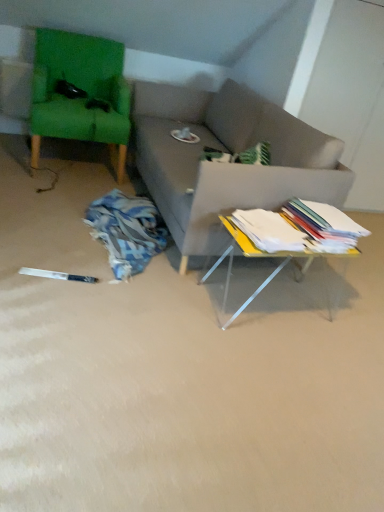
The image size is (384, 512). What do you see at coordinates (84, 94) in the screenshot?
I see `green fabric swivel chair at upper left` at bounding box center [84, 94].

Describe the element at coordinates (257, 256) in the screenshot. This screenshot has height=512, width=384. I see `yellow acrylic table at lower right` at that location.

Where is `green fabric swivel chair at upper left`? The height and width of the screenshot is (512, 384). green fabric swivel chair at upper left is located at coordinates (84, 94).

From a real-world perspective, between yellow acrylic table at lower right and green fabric swivel chair at upper left, who is vertically higher?

From a 3D spatial view, green fabric swivel chair at upper left is above.

Which object is closer to the camera taking this photo, yellow acrylic table at lower right or green fabric swivel chair at upper left?

Positioned in front is yellow acrylic table at lower right.

Which is farther from the camera, (241, 245) or (115, 91)?

The point (115, 91) is farther.

There is a yellow acrylic table at lower right. In order to click on swivel chair above it (from a real-world perspective) in this screenshot , I will do `click(84, 94)`.

Considering the relative sizes of white paper stack at center, which is counted as the second book, starting from the right, and yellow acrylic table at lower right in the image provided, is white paper stack at center, which is counted as the second book, starting from the right, smaller than yellow acrylic table at lower right?

Indeed, white paper stack at center, which is counted as the second book, starting from the right, has a smaller size compared to yellow acrylic table at lower right.

Could you tell me if white paper stack at center, which is counted as the second book, starting from the right, is turned towards yellow acrylic table at lower right?

No, white paper stack at center, which is counted as the second book, starting from the right, is not oriented towards yellow acrylic table at lower right.

From a real-world perspective, does white paper stack at center, arranged as the first book when viewed from the left, sit lower than yellow acrylic table at lower right?

No.

Does green fabric swivel chair at upper left appear on the right side of white paper stack at right, positioned as the 1th book in right-to-left order?

In fact, green fabric swivel chair at upper left is to the left of white paper stack at right, positioned as the 1th book in right-to-left order.

From a real-world perspective, is green fabric swivel chair at upper left on top of white paper stack at right, positioned as the 1th book in right-to-left order?

No, from a real-world perspective, green fabric swivel chair at upper left is not over white paper stack at right, positioned as the 1th book in right-to-left order

Which of these two, green fabric swivel chair at upper left or white paper stack at right, the 2th book when ordered from left to right, is thinner?

Thinner between the two is white paper stack at right, the 2th book when ordered from left to right.

Consider the image. Considering the sizes of green fabric swivel chair at upper left and white paper stack at right, the 2th book when ordered from left to right, in the image, is green fabric swivel chair at upper left taller or shorter than white paper stack at right, the 2th book when ordered from left to right,?

In the image, green fabric swivel chair at upper left appears to be taller than white paper stack at right, the 2th book when ordered from left to right.

Considering the positions of points (94, 63) and (249, 237), is point (94, 63) farther from camera compared to point (249, 237)?

Yes.

How far apart are green fabric swivel chair at upper left and white paper stack at center, arranged as the first book when viewed from the left?

The distance of green fabric swivel chair at upper left from white paper stack at center, arranged as the first book when viewed from the left, is 1.60 meters.

Would you say green fabric swivel chair at upper left is outside white paper stack at center, which is counted as the second book, starting from the right?

Yes, green fabric swivel chair at upper left is outside of white paper stack at center, which is counted as the second book, starting from the right.

From the picture: Could you tell me if green fabric swivel chair at upper left is facing white paper stack at center, which is counted as the second book, starting from the right?

Yes, green fabric swivel chair at upper left is turned towards white paper stack at center, which is counted as the second book, starting from the right.

Which is more to the left, white paper stack at center, arranged as the first book when viewed from the left, or green fabric swivel chair at upper left?

Positioned to the left is green fabric swivel chair at upper left.

Which of these two, white paper stack at center, which is counted as the second book, starting from the right, or green fabric swivel chair at upper left, is thinner?

With smaller width is white paper stack at center, which is counted as the second book, starting from the right.

Considering their positions, is white paper stack at center, which is counted as the second book, starting from the right, located in front of or behind green fabric swivel chair at upper left?

In the image, white paper stack at center, which is counted as the second book, starting from the right, appears in front of green fabric swivel chair at upper left.

Would you say white paper stack at center, arranged as the first book when viewed from the left, contains green fabric swivel chair at upper left?

No, green fabric swivel chair at upper left is not inside white paper stack at center, arranged as the first book when viewed from the left.

Which object is wider, yellow acrylic table at lower right or white paper stack at right, the 2th book when ordered from left to right?

yellow acrylic table at lower right.

Looking at this image, considering the sizes of objects yellow acrylic table at lower right and white paper stack at right, positioned as the 1th book in right-to-left order, in the image provided, who is shorter, yellow acrylic table at lower right or white paper stack at right, positioned as the 1th book in right-to-left order,?

white paper stack at right, positioned as the 1th book in right-to-left order, is shorter.

Is yellow acrylic table at lower right smaller than white paper stack at right, positioned as the 1th book in right-to-left order?

No, yellow acrylic table at lower right is not smaller than white paper stack at right, positioned as the 1th book in right-to-left order.

From their relative heights in the image, would you say white paper stack at right, the 2th book when ordered from left to right, is taller or shorter than white paper stack at center, arranged as the first book when viewed from the left?

In the image, white paper stack at right, the 2th book when ordered from left to right, appears to be taller than white paper stack at center, arranged as the first book when viewed from the left.

Looking at this image, is white paper stack at right, the 2th book when ordered from left to right, closer to the viewer compared to white paper stack at center, arranged as the first book when viewed from the left?

That is False.

From a real-world perspective, is white paper stack at right, positioned as the 1th book in right-to-left order, positioned above or below white paper stack at center, which is counted as the second book, starting from the right?

white paper stack at right, positioned as the 1th book in right-to-left order, is situated higher than white paper stack at center, which is counted as the second book, starting from the right, in the real world.

Locate an element on the screen. Image resolution: width=384 pixels, height=512 pixels. swivel chair that appears on the left of yellow acrylic table at lower right is located at coordinates (84, 94).

You are a GUI agent. You are given a task and a screenshot of the screen. Output one action in this format:
    pyautogui.click(x=<x>, y=<y>)
    Task: Click on the table in front of the white paper stack at center, which is counted as the second book, starting from the right
    This screenshot has height=512, width=384.
    Given the screenshot: What is the action you would take?
    pyautogui.click(x=257, y=256)

From the image, which object appears to be nearer to green fabric swivel chair at upper left, white paper stack at right, the 2th book when ordered from left to right, or yellow acrylic table at lower right?

yellow acrylic table at lower right is positioned closer to the anchor green fabric swivel chair at upper left.

Looking at this image, from the image, which object appears to be nearer to white paper stack at right, positioned as the 1th book in right-to-left order, white paper stack at center, arranged as the first book when viewed from the left, or yellow acrylic table at lower right?

Based on the image, white paper stack at center, arranged as the first book when viewed from the left, appears to be nearer to white paper stack at right, positioned as the 1th book in right-to-left order.

In the scene shown: Looking at the image, which one is located closer to green fabric swivel chair at upper left, white paper stack at right, positioned as the 1th book in right-to-left order, or white paper stack at center, which is counted as the second book, starting from the right?

Based on the image, white paper stack at center, which is counted as the second book, starting from the right, appears to be nearer to green fabric swivel chair at upper left.

When comparing their distances from green fabric swivel chair at upper left, does yellow acrylic table at lower right or white paper stack at center, which is counted as the second book, starting from the right, seem further?

white paper stack at center, which is counted as the second book, starting from the right, is further to green fabric swivel chair at upper left.

Based on the photo, considering their positions, is green fabric swivel chair at upper left positioned closer to white paper stack at right, positioned as the 1th book in right-to-left order, than white paper stack at center, which is counted as the second book, starting from the right?

white paper stack at center, which is counted as the second book, starting from the right, is positioned closer to the anchor white paper stack at right, positioned as the 1th book in right-to-left order.

Based on their spatial positions, is yellow acrylic table at lower right or green fabric swivel chair at upper left closer to white paper stack at center, arranged as the first book when viewed from the left?

Based on the image, yellow acrylic table at lower right appears to be nearer to white paper stack at center, arranged as the first book when viewed from the left.

Estimate the real-world distances between objects in this image. Which object is further from yellow acrylic table at lower right, white paper stack at right, the 2th book when ordered from left to right, or white paper stack at center, which is counted as the second book, starting from the right?

white paper stack at right, the 2th book when ordered from left to right, is positioned further to the anchor yellow acrylic table at lower right.

Which object lies further to the anchor point white paper stack at center, arranged as the first book when viewed from the left, white paper stack at right, the 2th book when ordered from left to right, or yellow acrylic table at lower right?

yellow acrylic table at lower right lies further to white paper stack at center, arranged as the first book when viewed from the left, than the other object.

Where is `book between green fabric swivel chair at upper left and white paper stack at right, the 2th book when ordered from left to right, from left to right`? Image resolution: width=384 pixels, height=512 pixels. book between green fabric swivel chair at upper left and white paper stack at right, the 2th book when ordered from left to right, from left to right is located at coordinates (268, 230).

I want to click on table between white paper stack at center, arranged as the first book when viewed from the left, and white paper stack at right, the 2th book when ordered from left to right, from left to right, so click(257, 256).

The height and width of the screenshot is (512, 384). I want to click on book located between green fabric swivel chair at upper left and yellow acrylic table at lower right in the left-right direction, so point(268,230).

Find the location of a particular element. The height and width of the screenshot is (512, 384). table between green fabric swivel chair at upper left and white paper stack at right, the 2th book when ordered from left to right, from left to right is located at coordinates (257, 256).